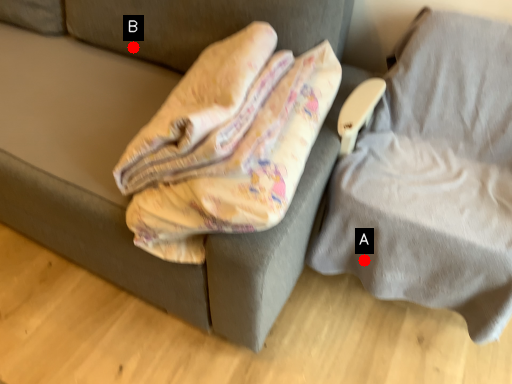
Question: Two points are circled on the image, labeled by A and B beside each circle. Which of the following is the farthest from the observer?

Choices:
 (A) A is further
 (B) B is further

Answer: (B)